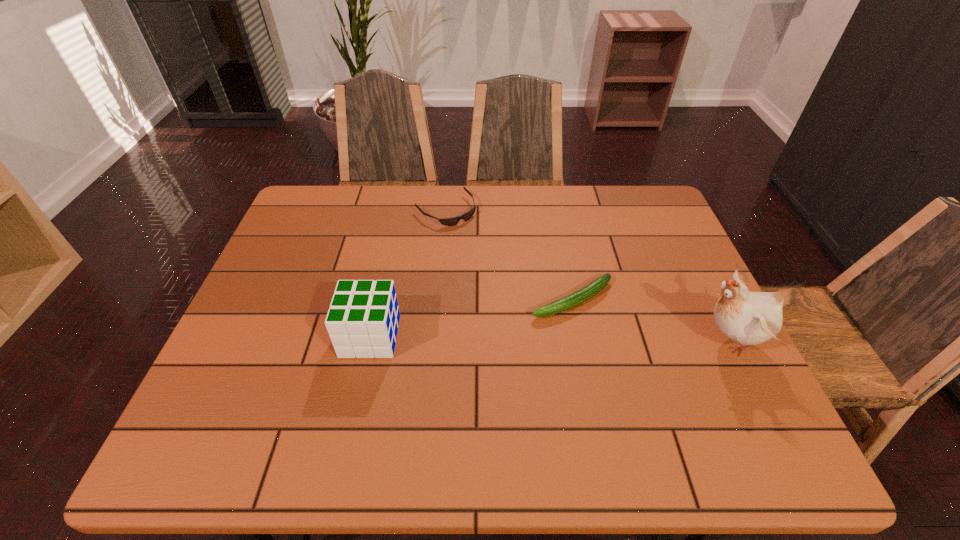
Where is `the third shortest object`? This screenshot has width=960, height=540. the third shortest object is located at coordinates (363, 319).

In order to click on the tallest object in this screenshot , I will do `click(748, 318)`.

The width and height of the screenshot is (960, 540). What are the coordinates of `bird` in the screenshot? It's located at (748, 318).

Where is `the third object from left to right`? This screenshot has width=960, height=540. the third object from left to right is located at coordinates (593, 288).

Find the location of `sunglasses`. sunglasses is located at coordinates click(452, 221).

Locate an element on the screen. This screenshot has height=540, width=960. the shortest object is located at coordinates (452, 221).

This screenshot has width=960, height=540. I want to click on vacant space located on the red face of the cube, so click(x=271, y=336).

Identify the location of vacant area situated 0.250m on the red face of the cube. (236, 336).

Find the location of a particular element. Image resolution: width=960 pixels, height=540 pixels. free space located 0.220m on the red face of the cube is located at coordinates (249, 336).

Find the location of a particular element. This screenshot has height=540, width=960. blank area located at the beak of the rightmost object is located at coordinates (636, 340).